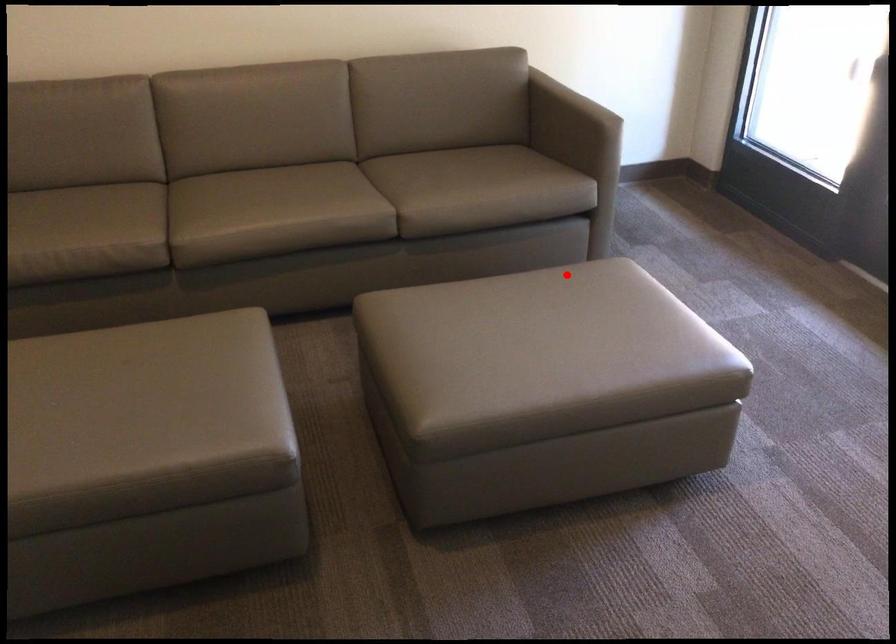
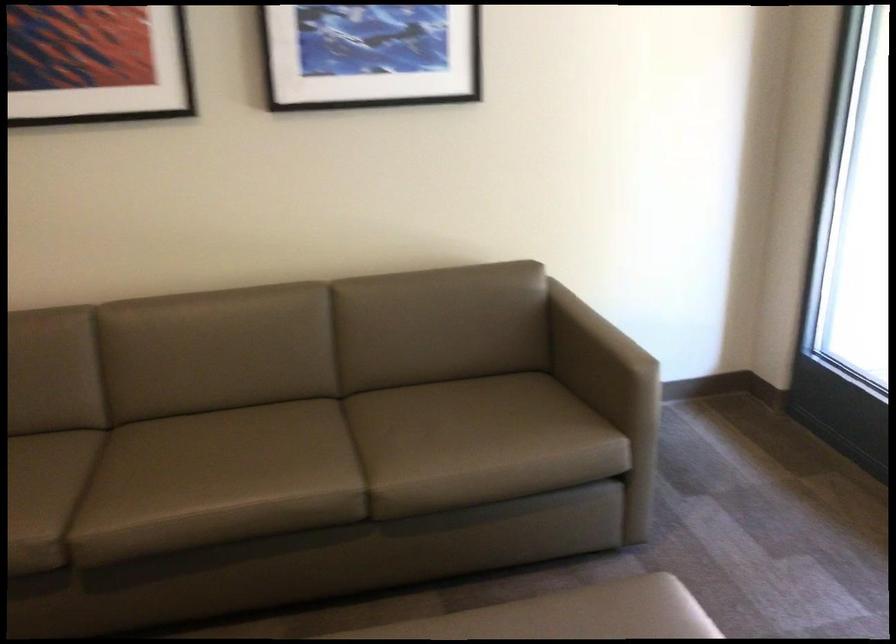
Find the pixel in the second image that matches the highlighted location in the first image.

(597, 618)